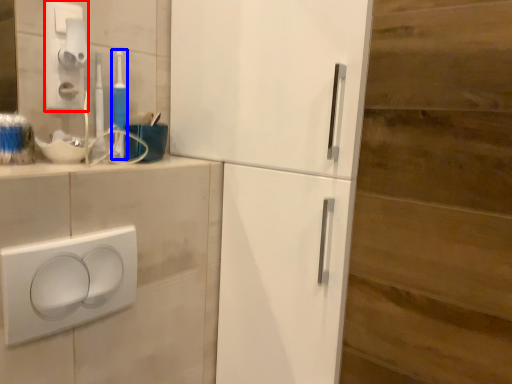
Question: Among these objects, which one is nearest to the camera, light switch (highlighted by a red box) or toothbrush (highlighted by a blue box)?

Choices:
 (A) light switch
 (B) toothbrush

Answer: (A)